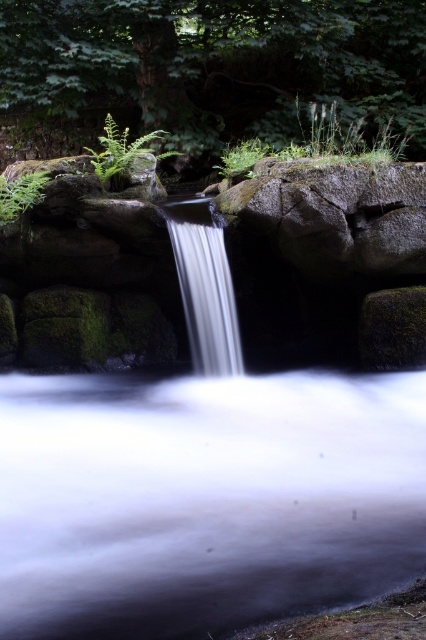
You are a botanist examining the green matte fern at upper left and the green fuzzy fern at upper center. Which fern is shorter?

The green matte fern at upper left is shorter than the green fuzzy fern at upper center.

You are a hiker standing at the base of the green leafy tree at upper center. You want to cross the stream created by the waterfall to reach a cabin on the other side. The stream is 1.5 meters wide. Can you safely cross the stream without getting your feet wet?

The stream created by the waterfall is 1.5 meters wide. Since you are a hiker at the base of the green leafy tree at upper center, you can safely cross the stream without getting your feet wet by stepping across the rocks or finding a dry path around it.

You are a botanist studying the ferns in this forest scene. You need to determine which fern has a larger width between the green matte fern at upper left and the green fuzzy fern at upper center. Based on the scene, can you conclude which one is wider?

The green matte fern at upper left might be wider than green fuzzy fern at upper center, so it is possible that the green matte fern at upper left has a larger width.